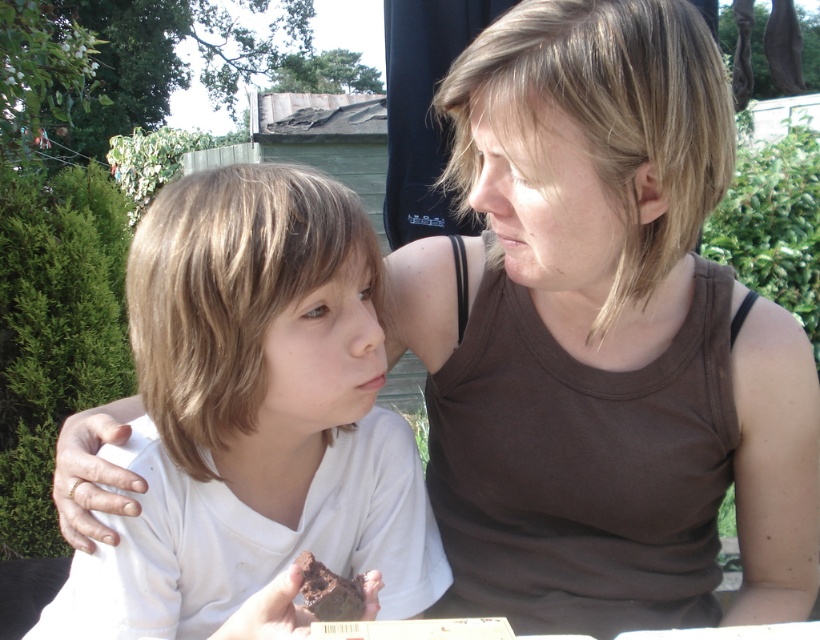
Question: Can you confirm if light brown hair at center is smaller than chocolate cake at lower center?

Choices:
 (A) yes
 (B) no

Answer: (B)

Question: Which point is farther from the camera taking this photo?

Choices:
 (A) (574, 92)
 (B) (166, 294)
 (C) (330, 620)

Answer: (B)

Question: Does light brown hair at center appear on the right side of chocolate cake at lower center?

Choices:
 (A) yes
 (B) no

Answer: (B)

Question: Which object is farther from the camera taking this photo?

Choices:
 (A) light brown hair at center
 (B) chocolate cake at lower center

Answer: (A)

Question: Is white matte shirt at left below chocolate cake at lower center?

Choices:
 (A) yes
 (B) no

Answer: (B)

Question: Which point is farther to the camera?

Choices:
 (A) (474, 109)
 (B) (310, 184)
 (C) (699, 141)

Answer: (B)